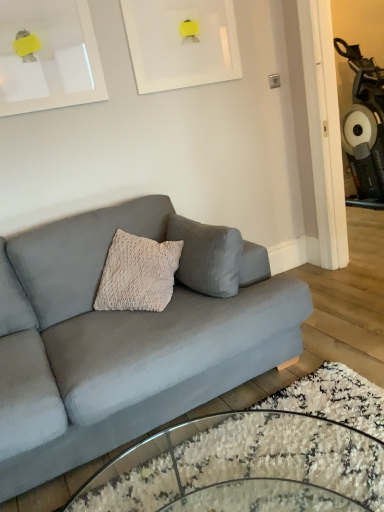
Measure the distance between white matte picture frame at upper center, the 1th picture frame positioned from the right, and camera.

They are 2.34 meters apart.

This screenshot has height=512, width=384. Describe the element at coordinates (181, 42) in the screenshot. I see `white matte picture frame at upper center, the second picture frame positioned from the left` at that location.

You are a GUI agent. You are given a task and a screenshot of the screen. Output one action in this format:
    pyautogui.click(x=<x>, y=<y>)
    Task: Click on the matte gray couch at center
    The image size is (384, 512).
    Given the screenshot: What is the action you would take?
    pyautogui.click(x=126, y=337)

The image size is (384, 512). Describe the element at coordinates (244, 467) in the screenshot. I see `clear glass coffee table at lower center` at that location.

Locate an element on the screen. This screenshot has height=512, width=384. clear glass coffee table at lower center is located at coordinates (244, 467).

Where is `white matte picture frame at upper center, which is the first picture frame from left to right`? white matte picture frame at upper center, which is the first picture frame from left to right is located at coordinates point(49,56).

Is matte gray couch at center smaller than white matte picture frame at upper center, the second picture frame positioned from the left?

No.

Locate an element on the screen. The image size is (384, 512). picture frame that is the 2nd object located behind the matte gray couch at center is located at coordinates (181, 42).

Which point is more distant from viewer, (173, 298) or (187, 8)?

The point (187, 8) is behind.

Would you say clear glass coffee table at lower center contains matte gray couch at center?

No, matte gray couch at center is not a part of clear glass coffee table at lower center.

Which point is more distant from viewer, (231, 465) or (51, 309)?

The point (51, 309) is behind.

Is clear glass coffee table at lower center thinner than matte gray couch at center?

No, clear glass coffee table at lower center is not thinner than matte gray couch at center.

Who is taller, clear glass coffee table at lower center or matte gray couch at center?

matte gray couch at center.

From the image's perspective, which is below, clear glass coffee table at lower center or white matte picture frame at upper center, the 1th picture frame positioned from the right?

Result: From the image's view, clear glass coffee table at lower center is below.

From a real-world perspective, relative to white matte picture frame at upper center, the 1th picture frame positioned from the right, is clear glass coffee table at lower center vertically above or below?

clear glass coffee table at lower center is below white matte picture frame at upper center, the 1th picture frame positioned from the right.

This screenshot has height=512, width=384. Find the location of `coffee table that appears on the right of white matte picture frame at upper center, the second picture frame positioned from the left`. coffee table that appears on the right of white matte picture frame at upper center, the second picture frame positioned from the left is located at coordinates (244, 467).

Is clear glass coffee table at lower center smaller than white matte picture frame at upper center, the second picture frame positioned from the left?

No.

Considering the relative positions of white matte picture frame at upper center, the 1th picture frame positioned from the right, and matte gray couch at center in the image provided, is white matte picture frame at upper center, the 1th picture frame positioned from the right, to the right of matte gray couch at center from the viewer's perspective?

Indeed, white matte picture frame at upper center, the 1th picture frame positioned from the right, is positioned on the right side of matte gray couch at center.

In the scene shown: Could you measure the distance between white matte picture frame at upper center, the second picture frame positioned from the left, and matte gray couch at center?

They are 4.15 feet apart.

Is point (229, 6) positioned before point (146, 410)?

No, it is not.

Is white matte picture frame at upper center, the second picture frame positioned from the left, positioned before matte gray couch at center?

No.

Can you tell me how much white matte picture frame at upper center, the 1th picture frame positioned from the right, and clear glass coffee table at lower center differ in facing direction?

They differ by 90.7 degrees in their facing directions.

Is white matte picture frame at upper center, the second picture frame positioned from the left, thinner than clear glass coffee table at lower center?

Yes, white matte picture frame at upper center, the second picture frame positioned from the left, is thinner than clear glass coffee table at lower center.

In the scene shown: From the image's perspective, is white matte picture frame at upper center, the second picture frame positioned from the left, on top of clear glass coffee table at lower center?

Yes, from the image's perspective, white matte picture frame at upper center, the second picture frame positioned from the left, is over clear glass coffee table at lower center.

Does point (180, 67) lie behind point (257, 423)?

Yes, it is behind point (257, 423).

Considering the sizes of matte gray couch at center and white matte picture frame at upper center, the 2th picture frame from the right, in the image, is matte gray couch at center wider or thinner than white matte picture frame at upper center, the 2th picture frame from the right,?

Considering their sizes, matte gray couch at center looks broader than white matte picture frame at upper center, the 2th picture frame from the right.

Where is `picture frame that is the 2nd object above the matte gray couch at center (from a real-world perspective)`? This screenshot has height=512, width=384. picture frame that is the 2nd object above the matte gray couch at center (from a real-world perspective) is located at coordinates (49, 56).

Which is closer to the camera, (53, 356) or (83, 93)?

Point (53, 356) appears to be closer to the viewer than point (83, 93).

Is white matte picture frame at upper center, which is the first picture frame from left to right, oriented towards clear glass coffee table at lower center?

No, white matte picture frame at upper center, which is the first picture frame from left to right, is not turned towards clear glass coffee table at lower center.

From the picture: Is white matte picture frame at upper center, the 2th picture frame from the right, inside or outside of clear glass coffee table at lower center?

white matte picture frame at upper center, the 2th picture frame from the right, exists outside the volume of clear glass coffee table at lower center.

Looking at this image, from the image's perspective, is white matte picture frame at upper center, which is the first picture frame from left to right, under clear glass coffee table at lower center?

No, from the image's perspective, white matte picture frame at upper center, which is the first picture frame from left to right, is not beneath clear glass coffee table at lower center.

The height and width of the screenshot is (512, 384). I want to click on the 2nd picture frame counting from the left of the clear glass coffee table at lower center, so click(49, 56).

From a real-world perspective, which picture frame is the 1st one above the matte gray couch at center? Please provide its 2D coordinates.

[(181, 42)]

The height and width of the screenshot is (512, 384). I want to click on studio couch to the left of clear glass coffee table at lower center, so click(x=126, y=337).

Considering their positions, is matte gray couch at center positioned further to white matte picture frame at upper center, the second picture frame positioned from the left, than clear glass coffee table at lower center?

clear glass coffee table at lower center.

When comparing their distances from white matte picture frame at upper center, the 2th picture frame from the right, does matte gray couch at center or clear glass coffee table at lower center seem further?

Among the two, clear glass coffee table at lower center is located further to white matte picture frame at upper center, the 2th picture frame from the right.

When comparing their distances from white matte picture frame at upper center, the second picture frame positioned from the left, does clear glass coffee table at lower center or white matte picture frame at upper center, the 2th picture frame from the right, seem closer?

Based on the image, white matte picture frame at upper center, the 2th picture frame from the right, appears to be nearer to white matte picture frame at upper center, the second picture frame positioned from the left.

Estimate the real-world distances between objects in this image. Which object is closer to white matte picture frame at upper center, which is the first picture frame from left to right, white matte picture frame at upper center, the 1th picture frame positioned from the right, or matte gray couch at center?

white matte picture frame at upper center, the 1th picture frame positioned from the right.

Considering their positions, is white matte picture frame at upper center, the 2th picture frame from the right, positioned closer to matte gray couch at center than white matte picture frame at upper center, the 1th picture frame positioned from the right?

white matte picture frame at upper center, the 2th picture frame from the right, is closer to matte gray couch at center.

Estimate the real-world distances between objects in this image. Which object is closer to matte gray couch at center, white matte picture frame at upper center, which is the first picture frame from left to right, or clear glass coffee table at lower center?

clear glass coffee table at lower center is positioned closer to the anchor matte gray couch at center.

Considering their positions, is white matte picture frame at upper center, the 2th picture frame from the right, positioned further to white matte picture frame at upper center, the 1th picture frame positioned from the right, than matte gray couch at center?

The object further to white matte picture frame at upper center, the 1th picture frame positioned from the right, is matte gray couch at center.

Which object lies further to the anchor point white matte picture frame at upper center, the 2th picture frame from the right, white matte picture frame at upper center, the 1th picture frame positioned from the right, or clear glass coffee table at lower center?

clear glass coffee table at lower center lies further to white matte picture frame at upper center, the 2th picture frame from the right, than the other object.

Locate an element on the screen. studio couch between white matte picture frame at upper center, the second picture frame positioned from the left, and clear glass coffee table at lower center, in the vertical direction is located at coordinates (126, 337).

In order to click on picture frame between white matte picture frame at upper center, the second picture frame positioned from the left, and matte gray couch at center from top to bottom in this screenshot , I will do `click(49, 56)`.

Locate an element on the screen. This screenshot has width=384, height=512. studio couch between white matte picture frame at upper center, the 2th picture frame from the right, and clear glass coffee table at lower center in the up-down direction is located at coordinates (126, 337).

This screenshot has height=512, width=384. I want to click on picture frame that lies between white matte picture frame at upper center, the second picture frame positioned from the left, and clear glass coffee table at lower center from top to bottom, so click(x=49, y=56).